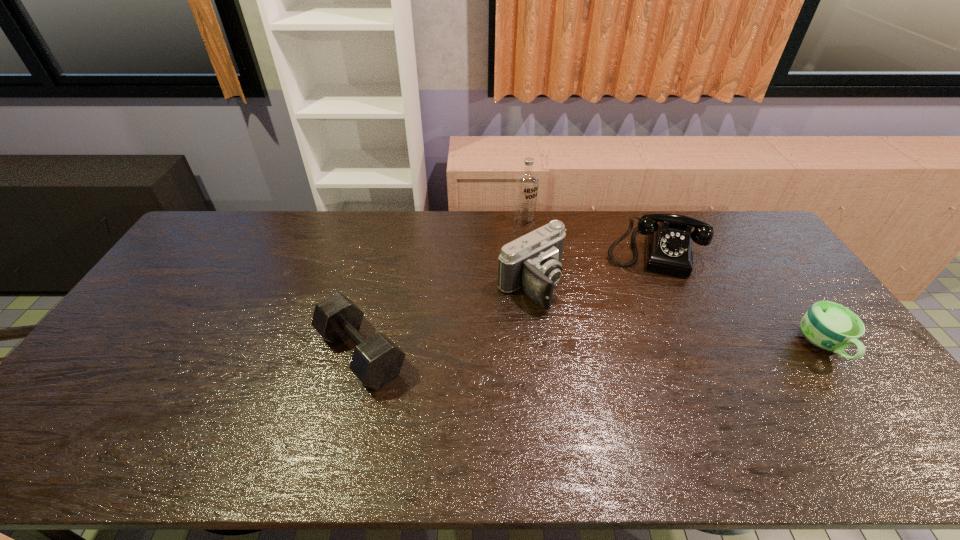
This screenshot has width=960, height=540. What are the coordinates of `vacant space located on the front label of the vodka` in the screenshot? It's located at (563, 281).

I want to click on free space located on the front label of the vodka, so click(x=553, y=267).

You are a GUI agent. You are given a task and a screenshot of the screen. Output one action in this format:
    pyautogui.click(x=<x>, y=<y>)
    Task: Click on the vacant region located at the front of the camera with an open lens cover
    The image size is (960, 540).
    Given the screenshot: What is the action you would take?
    pyautogui.click(x=578, y=326)

This screenshot has height=540, width=960. I want to click on free space located at the front of the camera with an open lens cover, so click(586, 332).

In order to click on free spot located at the front of the camera with an open lens cover in this screenshot , I will do `click(602, 346)`.

The image size is (960, 540). Identify the location of vacant space located on the dial of the telephone. (646, 360).

This screenshot has width=960, height=540. I want to click on free location located 0.090m on the dial of the telephone, so click(649, 297).

This screenshot has height=540, width=960. In order to click on blank space located on the dial of the telephone in this screenshot , I will do `click(647, 323)`.

I want to click on vodka positioned at the far edge, so click(x=526, y=191).

Identify the location of telephone that is at the far edge. (668, 243).